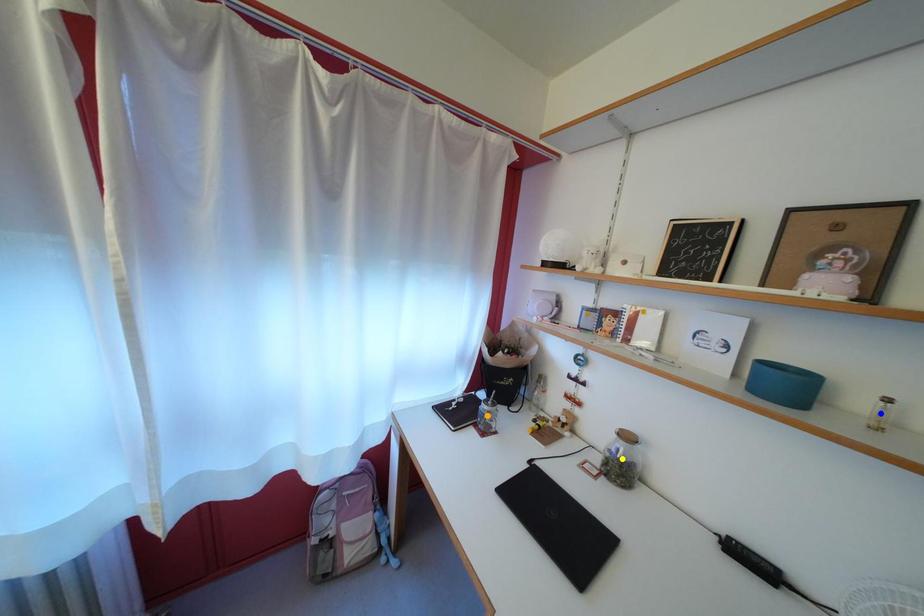
Order these from nearest to farthest:
yellow point, orange point, blue point

blue point → yellow point → orange point